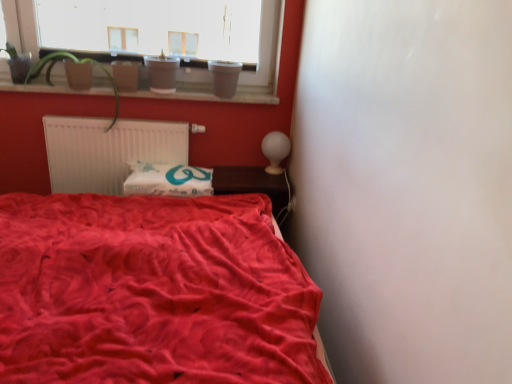
In order to face green matte plant at upper left, should I rotate leftwards or rightwards?

You should look left and rotate roughly 22.938 degrees.

Locate an element on the screen. This screenshot has width=512, height=384. white paper at center is located at coordinates (168, 180).

Find the location of a particular element. This screenshot has height=384, width=512. velvet red bed at lower left is located at coordinates (152, 292).

Where is `white matte radiator at upper left`? The width and height of the screenshot is (512, 384). white matte radiator at upper left is located at coordinates (108, 151).

From the image's perspective, which object appears higher, white plastic window at upper left or white paper at center?

white plastic window at upper left.

Which object is positioned more to the right, white plastic window at upper left or white paper at center?

white paper at center.

In the scene shown: Could you tell me if white plastic window at upper left is turned towards white paper at center?

No, white plastic window at upper left does not turn towards white paper at center.

Considering the sizes of objects white plastic window at upper left and white paper at center in the image provided, who is shorter, white plastic window at upper left or white paper at center?

white paper at center is shorter.

Is white paper at center turned away from brown wooden table at center?

No, white paper at center is not facing away from brown wooden table at center.

Can you see white paper at center touching brown wooden table at center?

There is a gap between white paper at center and brown wooden table at center.

Is white paper at center spatially inside brown wooden table at center, or outside of it?

white paper at center is not enclosed by brown wooden table at center.

How different are the orientations of white paper at center and brown wooden table at center in degrees?

white paper at center and brown wooden table at center are facing 2.13 degrees away from each other.

Is brown wooden table at center placed right next to white plastic window at upper left?

brown wooden table at center is not next to white plastic window at upper left, and they're not touching.

Where is `window above the brown wooden table at center (from the image's perspective)`? window above the brown wooden table at center (from the image's perspective) is located at coordinates (264, 59).

From the image's perspective, which one is positioned higher, brown wooden table at center or white plastic window at upper left?

From the image's view, white plastic window at upper left is above.

Which object is positioned more to the left, brown wooden table at center or white plastic window at upper left?

Positioned to the left is white plastic window at upper left.

Consider the image. Is velvet red bed at lower left a part of smooth wooden window sill at upper center?

No, velvet red bed at lower left is not a part of smooth wooden window sill at upper center.

Is smooth wooden window sill at upper center facing towards velvet red bed at lower left?

No, smooth wooden window sill at upper center is not facing towards velvet red bed at lower left.

Can you tell me how much smooth wooden window sill at upper center and velvet red bed at lower left differ in facing direction?

They differ by 91.6 degrees in their facing directions.

Is smooth wooden window sill at upper center looking in the opposite direction of green matte plant at upper left?

Yes, smooth wooden window sill at upper center's orientation is away from green matte plant at upper left.

Does smooth wooden window sill at upper center have a greater height compared to green matte plant at upper left?

Incorrect, the height of smooth wooden window sill at upper center is not larger of that of green matte plant at upper left.

Which is in front, smooth wooden window sill at upper center or green matte plant at upper left?

green matte plant at upper left is in front.

Considering the positions of points (38, 67) and (216, 172), is point (38, 67) closer to camera compared to point (216, 172)?

Yes, point (38, 67) is closer to viewer.

Is green matte plant at upper left next to brown wooden table at center?

green matte plant at upper left is not next to brown wooden table at center, and they're not touching.

Looking at the image, does green matte plant at upper left seem bigger or smaller compared to brown wooden table at center?

Considering their sizes, green matte plant at upper left takes up more space than brown wooden table at center.

From the image's perspective, between velvet red bed at lower left and brown wooden table at center, who is located below?

velvet red bed at lower left, from the image's perspective.

From a real-world perspective, between velvet red bed at lower left and brown wooden table at center, who is vertically lower?

In real-world perspective, velvet red bed at lower left is lower.

Is velvet red bed at lower left facing towards brown wooden table at center?

No, velvet red bed at lower left is not aimed at brown wooden table at center.

Where is `window that is on the left side of white paper at center`? The height and width of the screenshot is (384, 512). window that is on the left side of white paper at center is located at coordinates (264, 59).

I want to click on material positioned vertically above the brown wooden table at center (from a real-world perspective), so click(168, 180).

Estimate the real-world distances between objects in this image. Which object is further from velvet red bed at lower left, white plastic window at upper left or brown wooden table at center?

Based on the image, white plastic window at upper left appears to be further to velvet red bed at lower left.

Consider the image. Which object lies further to the anchor point white paper at center, green matte plant at upper left or brown wooden table at center?

Based on the image, green matte plant at upper left appears to be further to white paper at center.

Which object lies nearer to the anchor point white paper at center, white matte radiator at upper left or white plastic window at upper left?

The object closer to white paper at center is white matte radiator at upper left.

Considering their positions, is white matte radiator at upper left positioned further to smooth wooden window sill at upper center than white plastic window at upper left?

The object further to smooth wooden window sill at upper center is white matte radiator at upper left.

Considering their positions, is white matte radiator at upper left positioned closer to smooth wooden window sill at upper center than velvet red bed at lower left?

white matte radiator at upper left is positioned closer to the anchor smooth wooden window sill at upper center.

Based on their spatial positions, is brown wooden table at center or white paper at center closer to white matte radiator at upper left?

Based on the image, white paper at center appears to be nearer to white matte radiator at upper left.

Looking at the image, which one is located further to brown wooden table at center, white matte radiator at upper left or smooth wooden window sill at upper center?

Based on the image, white matte radiator at upper left appears to be further to brown wooden table at center.

Based on their spatial positions, is white paper at center or velvet red bed at lower left further from green matte plant at upper left?

Among the two, velvet red bed at lower left is located further to green matte plant at upper left.

This screenshot has height=384, width=512. In order to click on window sill between white matte radiator at upper left and brown wooden table at center in the horizontal direction in this screenshot , I will do `click(210, 94)`.

Locate an element on the screen. radiator between white plastic window at upper left and white paper at center in the vertical direction is located at coordinates (108, 151).

I want to click on window sill between white plastic window at upper left and white matte radiator at upper left from top to bottom, so click(210, 94).

This screenshot has height=384, width=512. I want to click on window between velvet red bed at lower left and white matte radiator at upper left along the z-axis, so click(x=264, y=59).